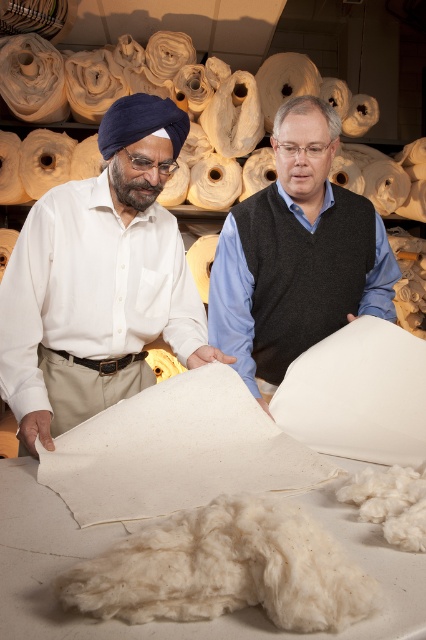
You are a quality control inspector in a textile factory. You need to check the dimensions of the white matte fabric at left and the matte white fabric at center. Which one should you prioritize checking first if the larger fabric requires immediate inspection?

A: The white matte fabric at left should be prioritized for inspection first since it is larger in size than the matte white fabric at center and requires immediate attention.

You are a quality inspector standing at the camera position. You need to check the white matte fabric at left. Can you reach it without moving your position?

The white matte fabric at left is 3.90 feet away from the camera, so you cannot reach it without moving your position.